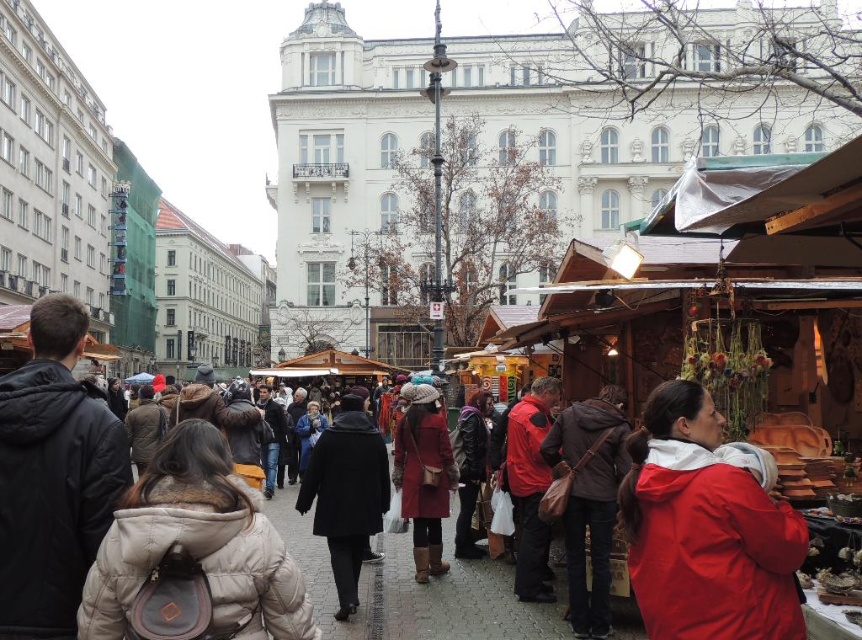
Which of these two, brown leather jacket at center or matte brown coat at center, stands shorter?

matte brown coat at center is shorter.

Who is more forward, (573, 516) or (404, 433)?

Point (573, 516) is in front.

Is point (603, 554) positioned after point (436, 410)?

No, (603, 554) is in front of (436, 410).

The width and height of the screenshot is (862, 640). Identify the location of brown leather jacket at center. (589, 499).

Is point (8, 636) more distant than point (336, 504)?

No, (8, 636) is closer to viewer.

Where is `dark gray jacket at left`? This screenshot has height=640, width=862. dark gray jacket at left is located at coordinates (53, 476).

Who is shorter, dark gray jacket at left or red matte jacket at center?

Standing shorter between the two is red matte jacket at center.

Does point (86, 483) come farther from viewer compared to point (511, 464)?

No, (86, 483) is closer to viewer.

The image size is (862, 640). What do you see at coordinates (53, 476) in the screenshot?
I see `dark gray jacket at left` at bounding box center [53, 476].

I want to click on dark gray jacket at left, so click(53, 476).